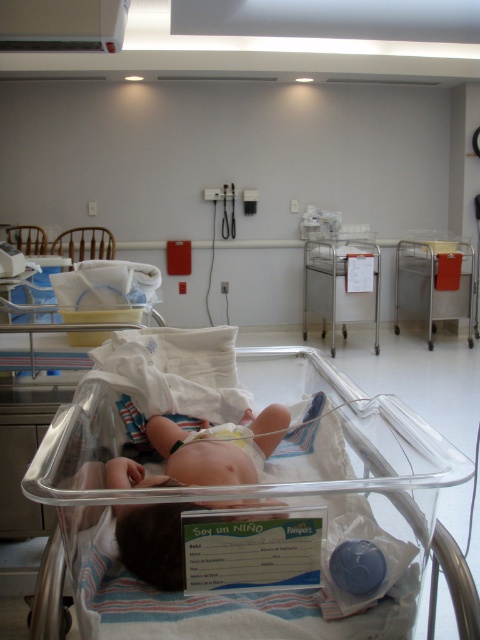
You are a nurse in the NICU who needs to place a new medical chart on the clear plastic infant bed at center so it can be easily viewed by the medical team. Considering the height of the metallic cart at center, will the chart be visible over the bed?

The clear plastic infant bed at center has a lesser height compared to the metallic cart at center. Since the bed is shorter than the cart, placing the chart on the bed might make it less visible over the bed because the cart is taller and could block the view.

You are a nurse in the NICU and need to place a small medical device between the two points labeled point (76, 580) and point (335, 294). Which point should the device be placed closer to to ensure it is nearer to the viewer?

The device should be placed closer to point (76, 580) because it is closer to the viewer than point (335, 294).